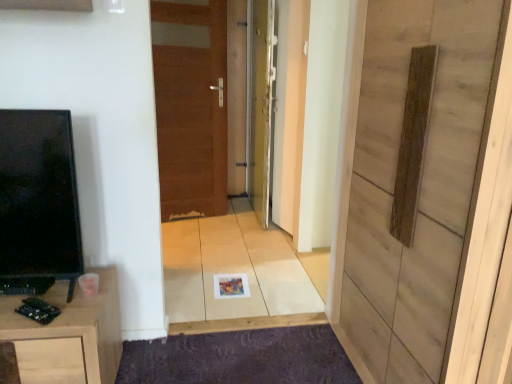
Question: Which direction should I rotate to look at wooden panel at center, the first door when ordered from right to left, — up or down?

Choices:
 (A) down
 (B) up

Answer: (A)

Question: Would you say wooden panel at center, which is counted as the third door, starting from the back, contains purple textured mat at lower center?

Choices:
 (A) yes
 (B) no

Answer: (B)

Question: Is wooden panel at center, which is the 3th door from left to right, to the left of purple textured mat at lower center from the viewer's perspective?

Choices:
 (A) yes
 (B) no

Answer: (B)

Question: Is wooden panel at center, which is the 3th door from left to right, in front of purple textured mat at lower center?

Choices:
 (A) no
 (B) yes

Answer: (B)

Question: From a real-world perspective, is wooden panel at center, which is the 3th door from left to right, located beneath purple textured mat at lower center?

Choices:
 (A) yes
 (B) no

Answer: (B)

Question: From the image's perspective, is wooden panel at center, which is the 3th door from left to right, located beneath purple textured mat at lower center?

Choices:
 (A) no
 (B) yes

Answer: (A)

Question: Is wooden panel at center, arranged as the first door when viewed from the front, outside purple textured mat at lower center?

Choices:
 (A) yes
 (B) no

Answer: (A)

Question: Can you confirm if metallic silver door at center, which appears as the second door when viewed from the right, is positioned to the left of wooden panel at center, which is counted as the third door, starting from the back?

Choices:
 (A) yes
 (B) no

Answer: (A)

Question: From a real-world perspective, is metallic silver door at center, which is the second door in back-to-front order, physically above wooden panel at center, arranged as the first door when viewed from the front?

Choices:
 (A) no
 (B) yes

Answer: (B)

Question: Is metallic silver door at center, which is the second door in left-to-right order, positioned with its back to wooden panel at center, the first door when ordered from right to left?

Choices:
 (A) yes
 (B) no

Answer: (B)

Question: Is metallic silver door at center, which appears as the second door when viewed from the right, taller than wooden panel at center, the first door when ordered from right to left?

Choices:
 (A) yes
 (B) no

Answer: (A)

Question: Is metallic silver door at center, which is the second door in back-to-front order, wider than wooden panel at center, which is the 3th door from left to right?

Choices:
 (A) no
 (B) yes

Answer: (A)

Question: Is metallic silver door at center, acting as the 2th door starting from the front, at the right side of wooden panel at center, which is the 3th door from left to right?

Choices:
 (A) yes
 (B) no

Answer: (B)

Question: Would you say wooden cabinet at lower left is outside brown wooden door at center, positioned as the 3th door in right-to-left order?

Choices:
 (A) yes
 (B) no

Answer: (A)